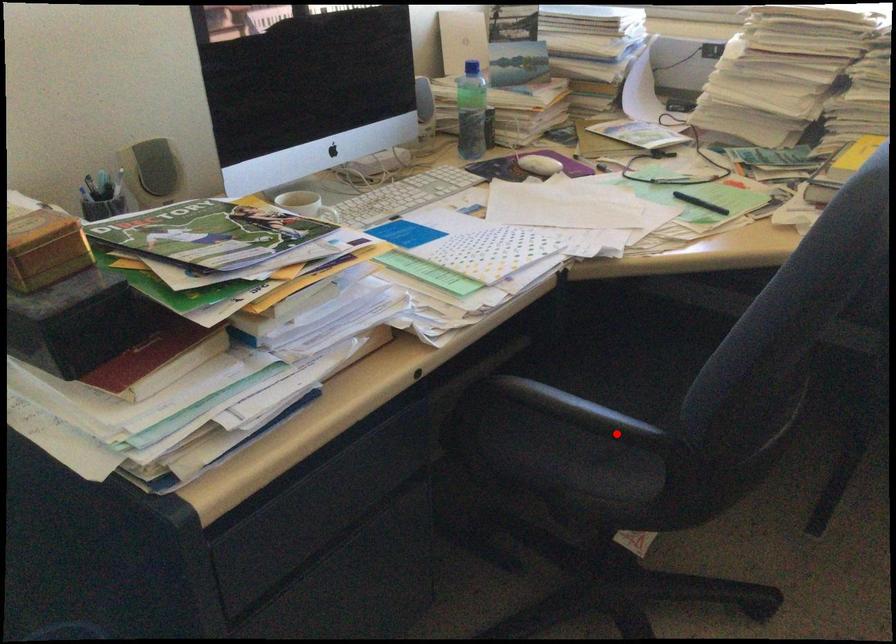
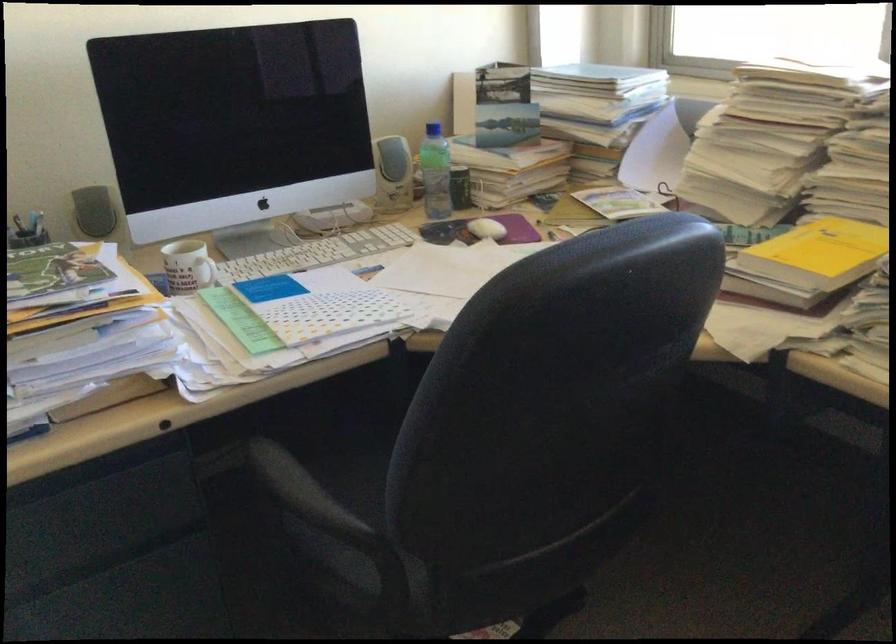
Where in the second image is the point corresponding to the highlighted location from the first image?

(314, 521)